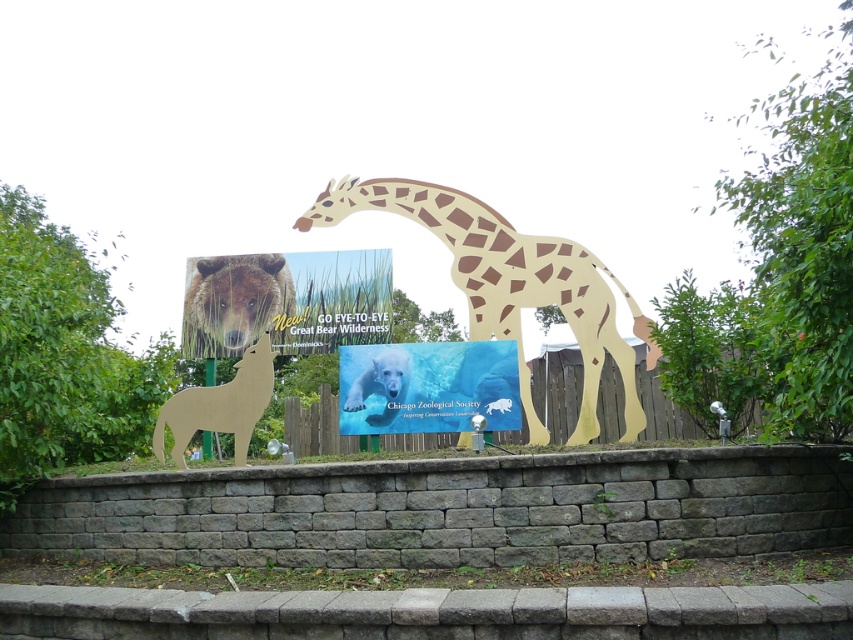
You are a visitor at the zoo and see the blue glossy polar bear at center and the wooden wolf at lower left. Which of these two cutouts is positioned more to the right in the image?

The blue glossy polar bear at center is positioned more to the right compared to the wooden wolf at lower left.

You are a zoo visitor trying to take a photo of the blue glossy polar bear at center without any obstructions. Is the wooden wolf at lower left blocking your view of the polar bear?

The wooden wolf at lower left is behind the blue glossy polar bear at center, so it won not block your view of the polar bear.

You are at a zoo and see the wooden giraffe at center and the blue glossy polar bear at center. Which one is placed higher up?

The wooden giraffe at center is positioned over the blue glossy polar bear at center, so the wooden giraffe at center is placed higher up.